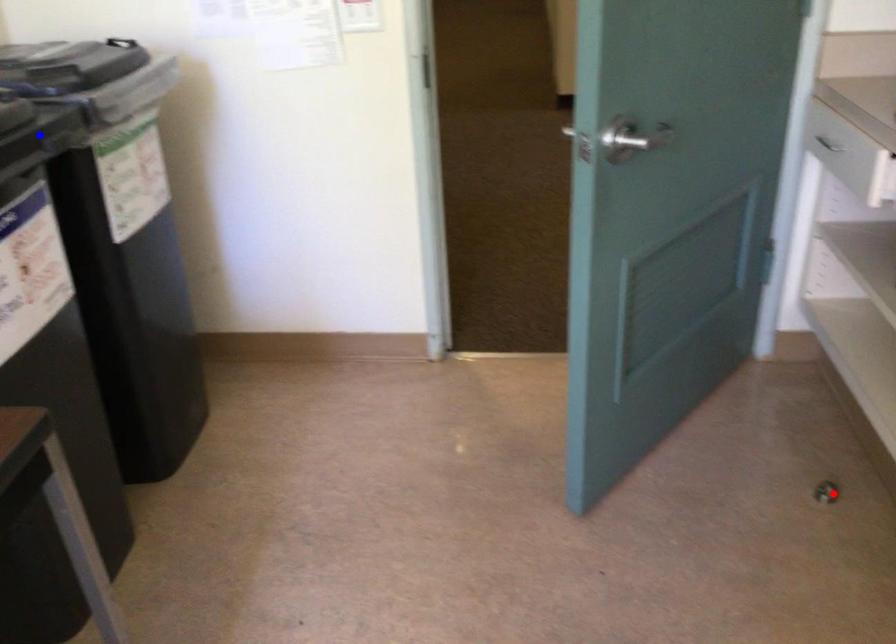
Question: In the image, two points are highlighted. Which point is nearer to the camera? Reply with the corresponding letter.

Choices:
 (A) blue point
 (B) red point

Answer: (A)